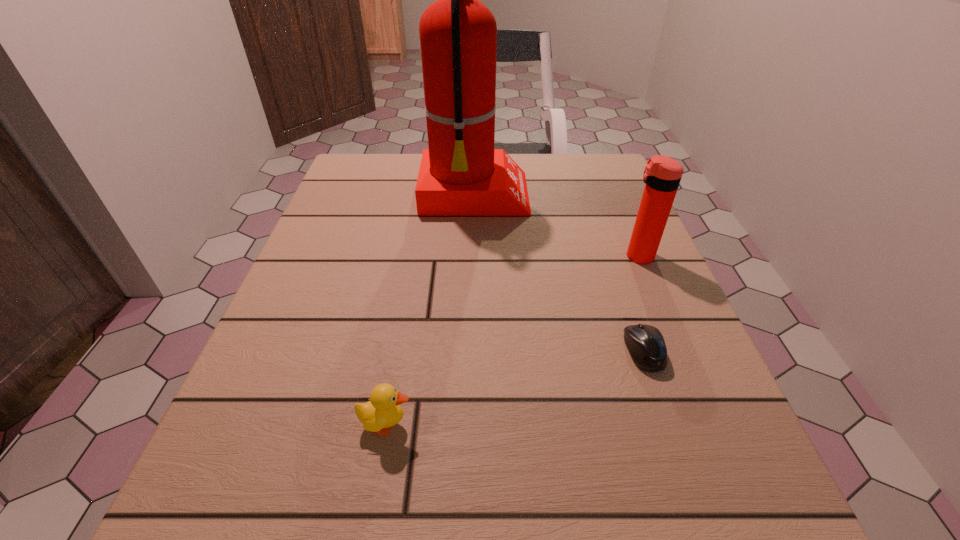
This screenshot has height=540, width=960. Find the location of `free location that satisfies the following two spatial constraints: 1. on the back side of the second nearest object; 2. on the front-facing side of the tallest object`. free location that satisfies the following two spatial constraints: 1. on the back side of the second nearest object; 2. on the front-facing side of the tallest object is located at coordinates (590, 196).